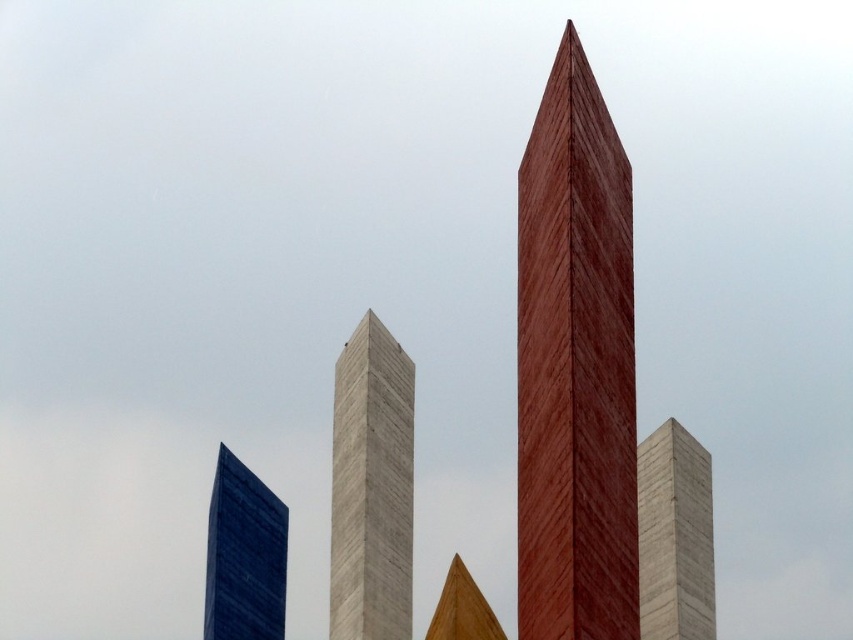
You are standing in front of the four obelisks described in the scene. You notice a point marked at coordinates (x=575, y=368). Which obelisk does this point belong to?

The point at coordinates (x=575, y=368) is on the wooden obelisk at center.

You are standing in front of the group of obelisks and want to place a new decorative statue exactly at the center of the entire structure. Based on the wooden obelisk at center, can you determine if the statue will be placed correctly?

The wooden obelisk at center is positioned at point (575, 368), which indicates it is already at the center of the structure. Therefore, placing the statue there would align it correctly with the existing central obelisk.

You are an architect designing a new park layout. You have two structures in the scene, the gray concrete tower at center and the blue glass tower at lower left. Which of these two towers is narrower in width?

The gray concrete tower at center has a lesser width compared to blue glass tower at lower left, so it is narrower.